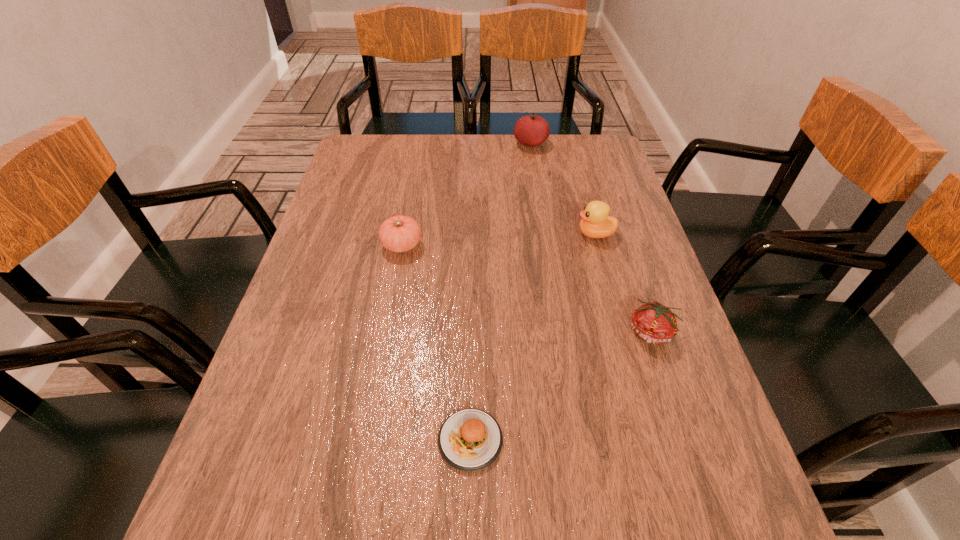
What are the coordinates of `the farthest tomato` in the screenshot? It's located at (532, 130).

This screenshot has height=540, width=960. I want to click on the third object from left to right, so click(x=532, y=130).

Locate an element on the screen. duckling is located at coordinates (595, 223).

Locate an element on the screen. Image resolution: width=960 pixels, height=540 pixels. the second farthest tomato is located at coordinates (400, 233).

Locate an element on the screen. The height and width of the screenshot is (540, 960). the leftmost object is located at coordinates (400, 233).

The width and height of the screenshot is (960, 540). What are the coordinates of `the fourth farthest object` in the screenshot? It's located at (652, 322).

Find the location of a particular element. the nearest tomato is located at coordinates (652, 322).

Locate an element on the screen. The height and width of the screenshot is (540, 960). the second object from left to right is located at coordinates (469, 440).

Locate an element on the screen. The image size is (960, 540). the shortest object is located at coordinates (469, 440).

Where is `vacant space located 0.120m on the front of the farthest tomato`? vacant space located 0.120m on the front of the farthest tomato is located at coordinates (536, 173).